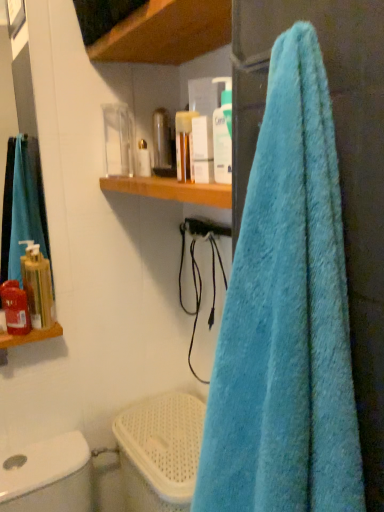
Question: Considering the relative positions of wooden shelf at upper center and matte white container at upper center, acting as the 4th toiletry starting from the front, in the image provided, is wooden shelf at upper center to the left of matte white container at upper center, acting as the 4th toiletry starting from the front, from the viewer's perspective?

Choices:
 (A) no
 (B) yes

Answer: (A)

Question: Is matte white container at upper center, acting as the 4th toiletry starting from the front, at the back of wooden shelf at upper center?

Choices:
 (A) yes
 (B) no

Answer: (B)

Question: Is wooden shelf at upper center beside matte white container at upper center, acting as the first toiletry starting from the back?

Choices:
 (A) yes
 (B) no

Answer: (B)

Question: Is wooden shelf at upper center surrounding matte white container at upper center, placed as the second toiletry when sorted from right to left?

Choices:
 (A) no
 (B) yes

Answer: (A)

Question: Considering the relative positions of wooden shelf at upper center and matte white container at upper center, which appears as the fourth toiletry when ordered from the bottom, in the image provided, is wooden shelf at upper center to the right of matte white container at upper center, which appears as the fourth toiletry when ordered from the bottom, from the viewer's perspective?

Choices:
 (A) yes
 (B) no

Answer: (A)

Question: From a real-world perspective, is wooden shelf at upper center physically below matte white container at upper center, which appears as the fourth toiletry when ordered from the bottom?

Choices:
 (A) no
 (B) yes

Answer: (A)

Question: Is white plastic toilet bowl at lower left far away from matte white container at upper center, placed as the second toiletry when sorted from right to left?

Choices:
 (A) yes
 (B) no

Answer: (B)

Question: From a real-world perspective, does white plastic toilet bowl at lower left sit lower than matte white container at upper center, which is the third toiletry from left to right?

Choices:
 (A) no
 (B) yes

Answer: (B)

Question: Is white plastic toilet bowl at lower left touching matte white container at upper center, which appears as the fourth toiletry when ordered from the bottom?

Choices:
 (A) yes
 (B) no

Answer: (B)

Question: Is white plastic toilet bowl at lower left outside matte white container at upper center, which appears as the fourth toiletry when ordered from the bottom?

Choices:
 (A) no
 (B) yes

Answer: (B)

Question: Considering the relative sizes of white plastic toilet bowl at lower left and matte white container at upper center, acting as the first toiletry starting from the back, in the image provided, is white plastic toilet bowl at lower left shorter than matte white container at upper center, acting as the first toiletry starting from the back,?

Choices:
 (A) no
 (B) yes

Answer: (A)

Question: Is matte white container at upper center, placed as the second toiletry when sorted from right to left, at the back of white plastic toilet bowl at lower left?

Choices:
 (A) yes
 (B) no

Answer: (B)

Question: Does blue fluffy towel at right lie in front of matte white container at upper center, placed as the 1th toiletry when sorted from top to bottom?

Choices:
 (A) no
 (B) yes

Answer: (B)